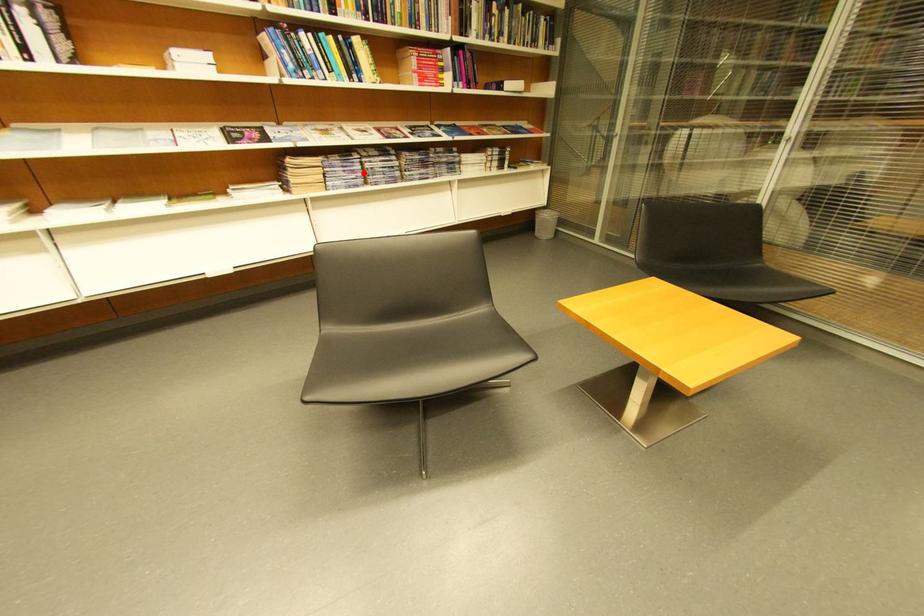
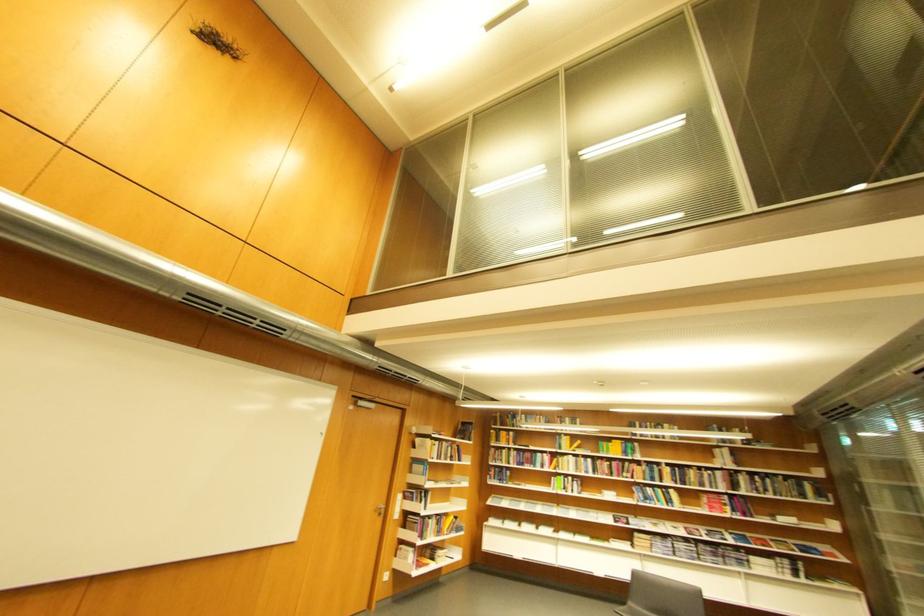
Where in the second image is the point corresponding to the highlighted location from the first image?

(677, 549)